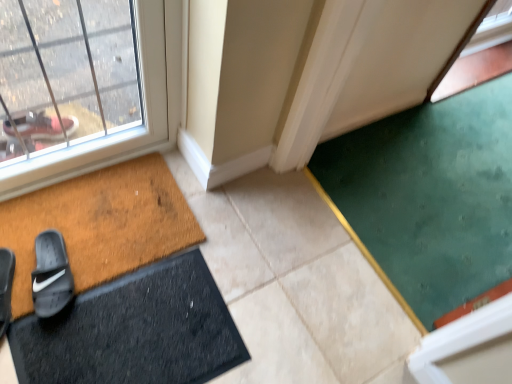
I want to click on vacant area on the back side of black rubber bath mat at lower left, positioned as the first bath mat in bottom-to-top order, so click(x=245, y=223).